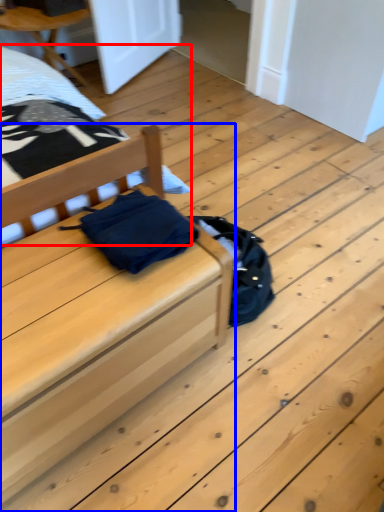
Question: Among these objects, which one is nearest to the camera, bed (highlighted by a red box) or furniture (highlighted by a blue box)?

Choices:
 (A) bed
 (B) furniture

Answer: (B)